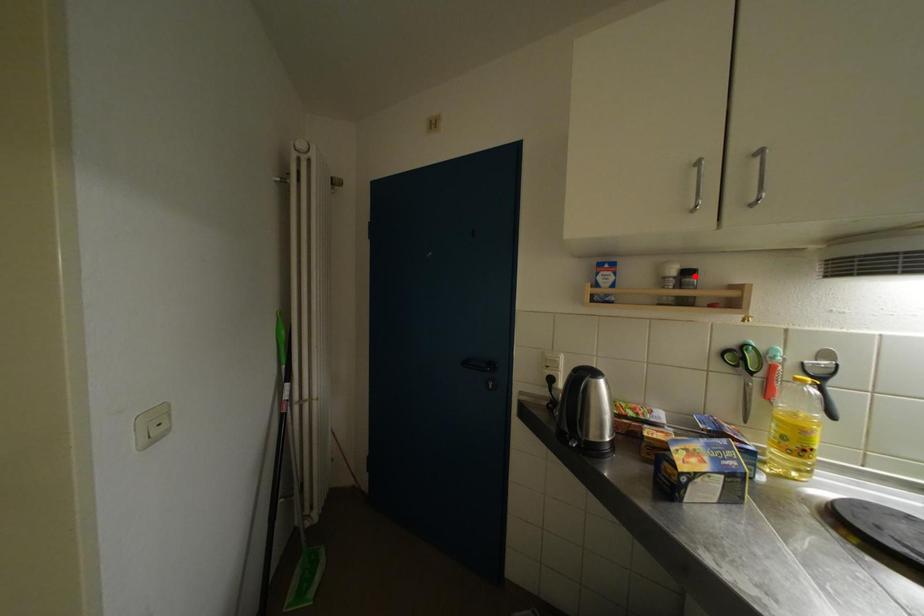
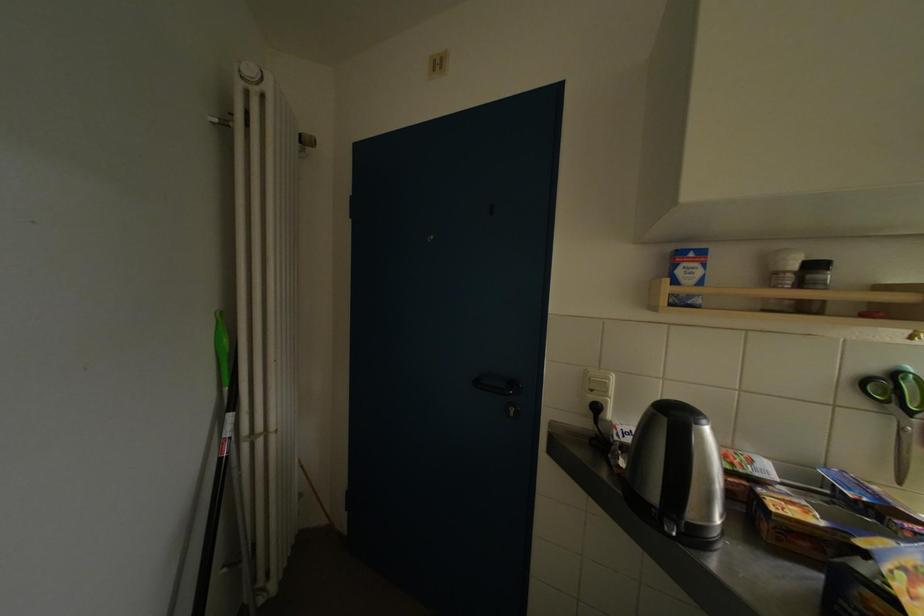
Find the pixel in the second image that matches the highlighted location in the first image.

(821, 270)